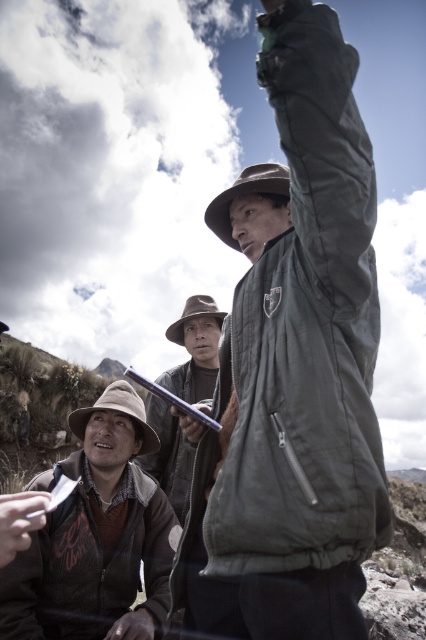
Question: Which of these objects is positioned closest to the green matte jacket at center?

Choices:
 (A) brown felt cowboy hat at upper center
 (B) dark brown leather hand at lower left
 (C) white matte paper at lower left
 (D) leather glove at center

Answer: (D)

Question: Is white matte paper at lower left bigger than dark brown leather hand at lower left?

Choices:
 (A) no
 (B) yes

Answer: (B)

Question: Does brown suede hat at lower left appear on the right side of brown felt cowboy hat at lower left?

Choices:
 (A) yes
 (B) no

Answer: (A)

Question: Does brown felt hat at center come behind dark brown leather hand at lower left?

Choices:
 (A) no
 (B) yes

Answer: (B)

Question: Based on their relative distances, which object is nearer to the leather glove at center?

Choices:
 (A) brown felt hat at center
 (B) brown suede hat at lower left

Answer: (B)

Question: Which of the following is the closest to the observer?

Choices:
 (A) green matte jacket at center
 (B) brown felt cowboy hat at upper center
 (C) leather glove at center
 (D) brown felt cowboy hat at center

Answer: (A)